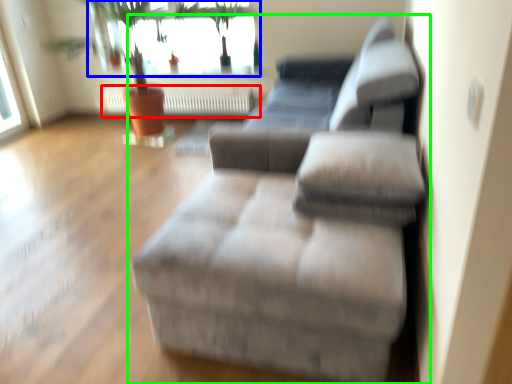
Question: Estimate the real-world distances between objects in this image. Which object is closer to radiator (highlighted by a red box), window (highlighted by a blue box) or studio couch (highlighted by a green box)?

Choices:
 (A) window
 (B) studio couch

Answer: (A)